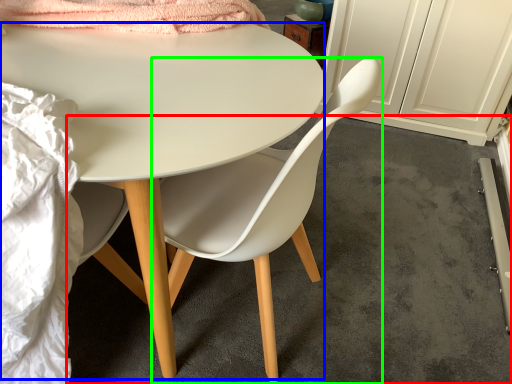
Question: Which object is positioned farthest from concrete (highlighted by a red box)? Select from desk (highlighted by a blue box) and chair (highlighted by a green box).

Choices:
 (A) desk
 (B) chair

Answer: (A)